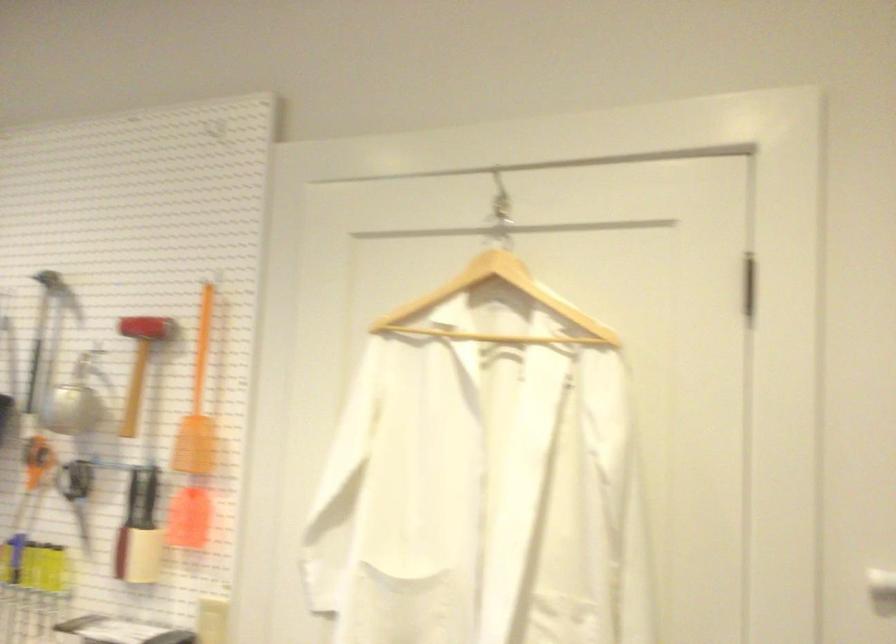
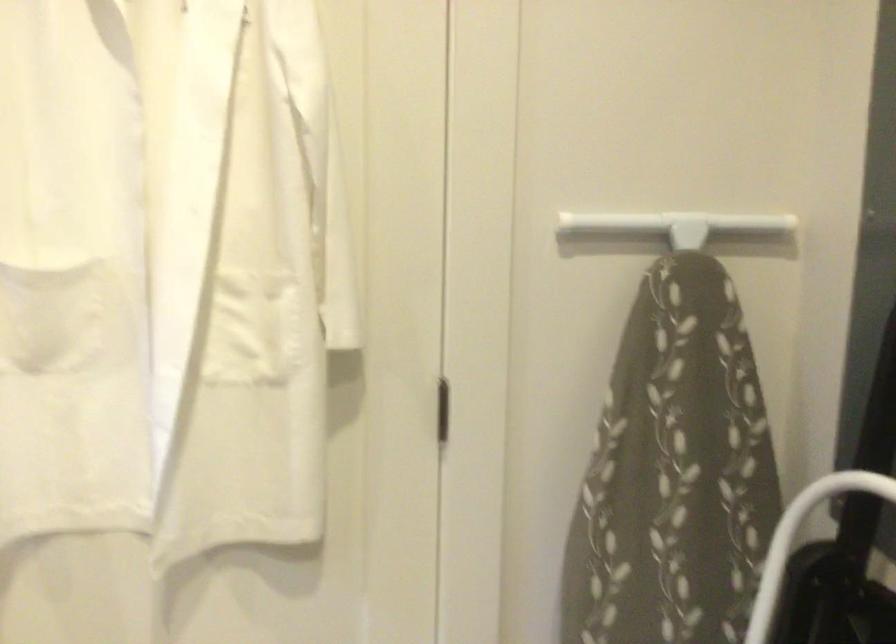
Question: Based on the continuous images, in which direction is the camera rotating? Reply with the corresponding letter.

Choices:
 (A) Left
 (B) Right
 (C) Up
 (D) Down

Answer: (B)